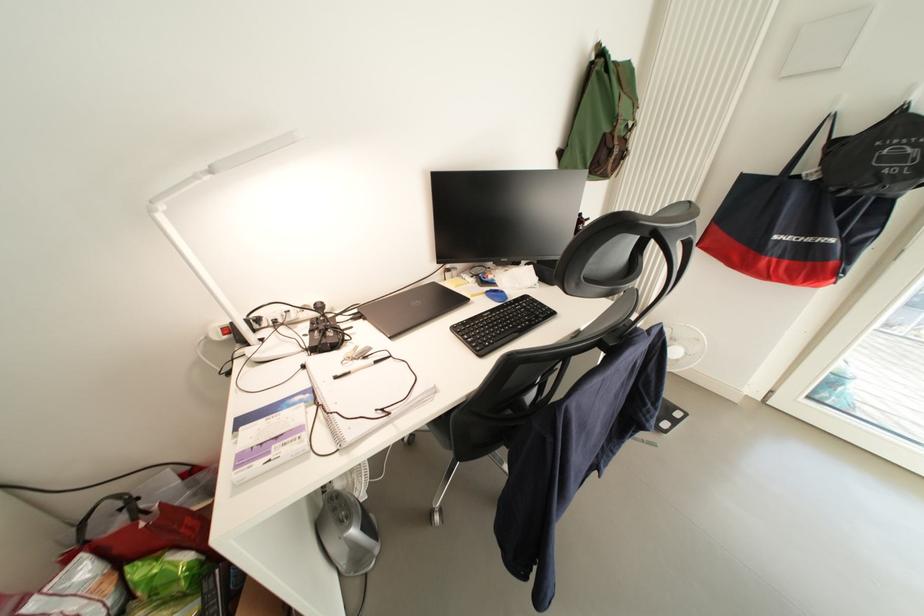
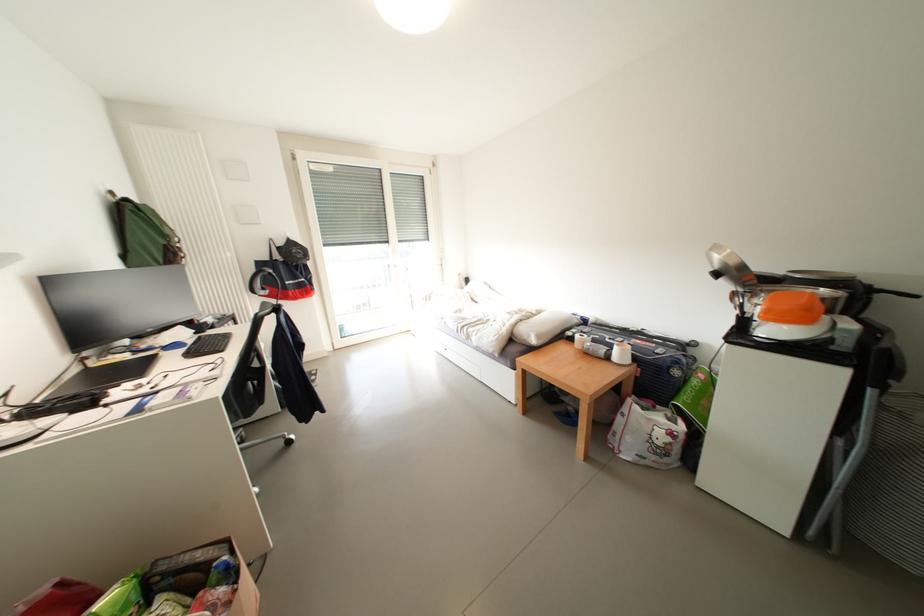
Locate, in the second image, the point that corresponds to point (568, 156) in the first image.

(131, 259)